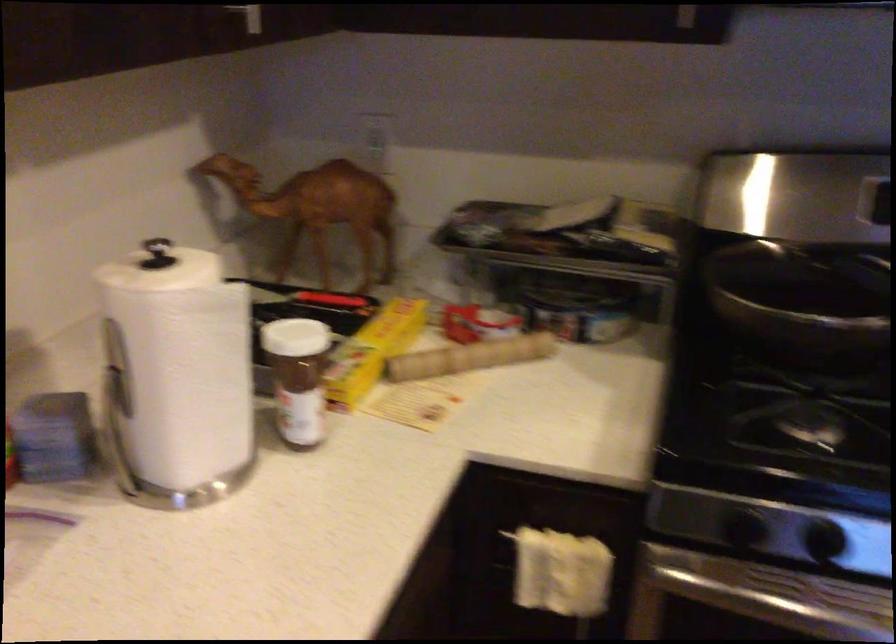
Find where to grasp the pan handle. Please return your answer as a coordinate pair (x, y).

(803, 296)